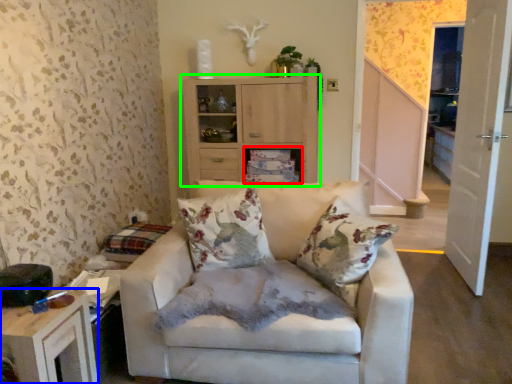
Question: Considering the real-world distances, which object is farthest from shelf (highlighted by a red box)? table (highlighted by a blue box) or cabinetry (highlighted by a green box)?

Choices:
 (A) table
 (B) cabinetry

Answer: (A)